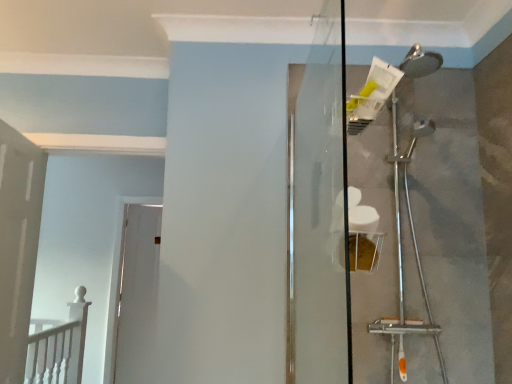
Where is `white glossy door at center, which is the second door from front to back`? The image size is (512, 384). white glossy door at center, which is the second door from front to back is located at coordinates (138, 295).

This screenshot has width=512, height=384. In order to click on transparent glass screen door at center in this screenshot , I will do `click(320, 213)`.

In order to click on white painted wood door at left, which is the first door in front-to-back order in this screenshot , I will do `click(18, 244)`.

Find the location of a particular element. This screenshot has height=384, width=512. white wooden railing at lower left is located at coordinates (58, 346).

Is white glossy door at center, which is the second door from front to back, facing towards white painted wood door at left, which is counted as the 2th door, starting from the back?

No.

From a real-world perspective, is white glossy door at center, the 1th door viewed from the back, physically located above or below white painted wood door at left, which is the first door in front-to-back order?

white glossy door at center, the 1th door viewed from the back, is below white painted wood door at left, which is the first door in front-to-back order.

Can you confirm if white glossy door at center, the 1th door viewed from the back, is positioned to the left of white painted wood door at left, which is counted as the 2th door, starting from the back?

Correct, you'll find white glossy door at center, the 1th door viewed from the back, to the left of white painted wood door at left, which is counted as the 2th door, starting from the back.

From the image's perspective, which is below, white glossy door at center, the 1th door viewed from the back, or white painted wood door at left, which is counted as the 2th door, starting from the back?

white glossy door at center, the 1th door viewed from the back, appears lower in the image.

Is white wooden railing at lower left turned away from transparent glass screen door at center?

No, transparent glass screen door at center is not at the back of white wooden railing at lower left.

Is white wooden railing at lower left situated inside transparent glass screen door at center or outside?

white wooden railing at lower left is not inside transparent glass screen door at center, it's outside.

Is there a large distance between white wooden railing at lower left and transparent glass screen door at center?

That's right, there is a large distance between white wooden railing at lower left and transparent glass screen door at center.

Which is behind, white wooden railing at lower left or transparent glass screen door at center?

white wooden railing at lower left.

Measure the distance from white wooden railing at lower left to white glossy door at center, which is the second door from front to back.

3.48 feet.

Is white wooden railing at lower left inside or outside of white glossy door at center, which is the second door from front to back?

white wooden railing at lower left is located beyond the bounds of white glossy door at center, which is the second door from front to back.

From the image's perspective, would you say white wooden railing at lower left is shown under white glossy door at center, the 1th door viewed from the back?

No, from the image's perspective, white wooden railing at lower left is not beneath white glossy door at center, the 1th door viewed from the back.

From a real-world perspective, relative to white glossy door at center, which is the second door from front to back, is white wooden railing at lower left vertically above or below?

Clearly, from a real-world perspective, white wooden railing at lower left is below white glossy door at center, which is the second door from front to back.

From a real-world perspective, is white wooden railing at lower left positioned over white painted wood door at left, which is the first door in front-to-back order, based on gravity?

No, from a real-world perspective, white wooden railing at lower left is not over white painted wood door at left, which is the first door in front-to-back order

From the image's perspective, would you say white wooden railing at lower left is positioned over white painted wood door at left, which is counted as the 2th door, starting from the back?

No.

Considering the points (34, 343) and (19, 326), which point is in front, point (34, 343) or point (19, 326)?

The point (19, 326) is in front.

How far apart are white painted wood door at left, which is the first door in front-to-back order, and transparent glass screen door at center?

A distance of 1.43 meters exists between white painted wood door at left, which is the first door in front-to-back order, and transparent glass screen door at center.

From a real-world perspective, is white painted wood door at left, which is counted as the 2th door, starting from the back, positioned above or below transparent glass screen door at center?

white painted wood door at left, which is counted as the 2th door, starting from the back, is below transparent glass screen door at center.

From the image's perspective, is white painted wood door at left, which is counted as the 2th door, starting from the back, on top of transparent glass screen door at center?

No, from the image's perspective, white painted wood door at left, which is counted as the 2th door, starting from the back, is not above transparent glass screen door at center.

Does white painted wood door at left, which is the first door in front-to-back order, come in front of transparent glass screen door at center?

No, white painted wood door at left, which is the first door in front-to-back order, is behind transparent glass screen door at center.

Which is in front, point (42, 152) or point (34, 320)?

Point (42, 152)

Can you tell me how much white painted wood door at left, which is counted as the 2th door, starting from the back, and white wooden railing at lower left differ in facing direction?

white painted wood door at left, which is counted as the 2th door, starting from the back, and white wooden railing at lower left are facing 1.73 degrees away from each other.

From a real-world perspective, count 2nd doors upward from the white wooden railing at lower left and point to it. Please provide its 2D coordinates.

[(18, 244)]

Does white painted wood door at left, which is counted as the 2th door, starting from the back, have a lesser width compared to white wooden railing at lower left?

Yes, white painted wood door at left, which is counted as the 2th door, starting from the back, is thinner than white wooden railing at lower left.

How distant is white painted wood door at left, which is the first door in front-to-back order, from white glossy door at center, the 1th door viewed from the back?

They are 7.00 feet apart.

From the image's perspective, which one is positioned lower, white painted wood door at left, which is the first door in front-to-back order, or white glossy door at center, which is the second door from front to back?

white glossy door at center, which is the second door from front to back, is shown below in the image.

Could white glossy door at center, the 1th door viewed from the back, be considered to be inside white painted wood door at left, which is counted as the 2th door, starting from the back?

Actually, white glossy door at center, the 1th door viewed from the back, is outside white painted wood door at left, which is counted as the 2th door, starting from the back.

Would you say white painted wood door at left, which is counted as the 2th door, starting from the back, is to the left or to the right of white glossy door at center, the 1th door viewed from the back, in the picture?

In the image, white painted wood door at left, which is counted as the 2th door, starting from the back, appears on the right side of white glossy door at center, the 1th door viewed from the back.

Locate an element on the screen. door in front of the white glossy door at center, the 1th door viewed from the back is located at coordinates (18, 244).

Where is `rail below the transparent glass screen door at center (from a real-world perspective)`? This screenshot has width=512, height=384. rail below the transparent glass screen door at center (from a real-world perspective) is located at coordinates (58, 346).

Based on the photo, looking at the image, which one is located further to transparent glass screen door at center, white wooden railing at lower left or white glossy door at center, which is the second door from front to back?

white glossy door at center, which is the second door from front to back, lies further to transparent glass screen door at center than the other object.

From the picture: Considering their positions, is white wooden railing at lower left positioned further to white painted wood door at left, which is the first door in front-to-back order, than white glossy door at center, the 1th door viewed from the back?

white glossy door at center, the 1th door viewed from the back, is further to white painted wood door at left, which is the first door in front-to-back order.

In the scene shown: From the image, which object appears to be farther from transparent glass screen door at center, white wooden railing at lower left or white painted wood door at left, which is counted as the 2th door, starting from the back?

white wooden railing at lower left lies further to transparent glass screen door at center than the other object.

From the image, which object appears to be nearer to white wooden railing at lower left, transparent glass screen door at center or white painted wood door at left, which is the first door in front-to-back order?

white painted wood door at left, which is the first door in front-to-back order, is closer to white wooden railing at lower left.

Estimate the real-world distances between objects in this image. Which object is further from white painted wood door at left, which is the first door in front-to-back order, white glossy door at center, which is the second door from front to back, or transparent glass screen door at center?

Among the two, white glossy door at center, which is the second door from front to back, is located further to white painted wood door at left, which is the first door in front-to-back order.

Based on the photo, estimate the real-world distances between objects in this image. Which object is closer to white wooden railing at lower left, white painted wood door at left, which is the first door in front-to-back order, or transparent glass screen door at center?

white painted wood door at left, which is the first door in front-to-back order, is positioned closer to the anchor white wooden railing at lower left.

From the picture: When comparing their distances from white wooden railing at lower left, does white glossy door at center, which is the second door from front to back, or transparent glass screen door at center seem closer?

Based on the image, white glossy door at center, which is the second door from front to back, appears to be nearer to white wooden railing at lower left.

When comparing their distances from white glossy door at center, the 1th door viewed from the back, does white wooden railing at lower left or transparent glass screen door at center seem further?

transparent glass screen door at center.

In order to click on rail located between white painted wood door at left, which is the first door in front-to-back order, and white glossy door at center, the 1th door viewed from the back, in the depth direction in this screenshot , I will do `click(58, 346)`.

The height and width of the screenshot is (384, 512). Find the location of `door between transparent glass screen door at center and white glossy door at center, the 1th door viewed from the back, in the front-back direction`. door between transparent glass screen door at center and white glossy door at center, the 1th door viewed from the back, in the front-back direction is located at coordinates (18, 244).

What are the coordinates of `rail positioned between transparent glass screen door at center and white glossy door at center, the 1th door viewed from the back, from near to far` in the screenshot? It's located at (58, 346).